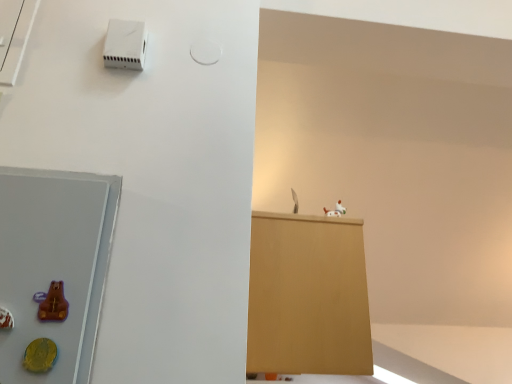
This screenshot has width=512, height=384. What do you see at coordinates (308, 296) in the screenshot?
I see `wooden board at upper center` at bounding box center [308, 296].

In the scene shown: Measure the distance between wooden board at upper center and camera.

The distance of wooden board at upper center from camera is 3.42 feet.

Identify the location of wooden board at upper center. (308, 296).

Locate an element on the screen. The width and height of the screenshot is (512, 384). wooden board at upper center is located at coordinates (308, 296).